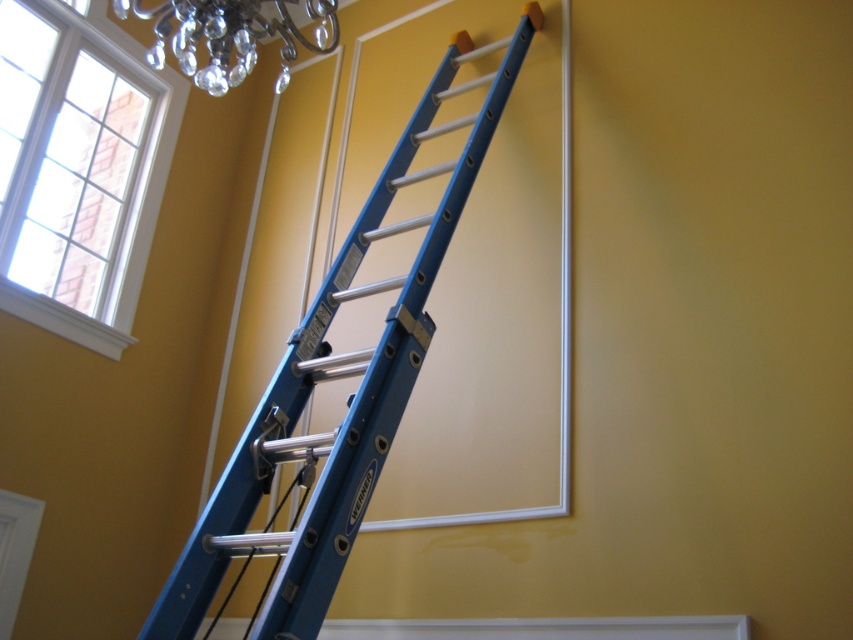
Question: Which object is positioned closest to the clear glass window at upper left?

Choices:
 (A) crystal glass chandelier at upper left
 (B) blue metallic ladder at upper right

Answer: (A)

Question: Which point appears closest to the camera in this image?

Choices:
 (A) (26, 131)
 (B) (412, 157)

Answer: (B)

Question: Does blue metallic ladder at upper right have a greater width compared to crystal glass chandelier at upper left?

Choices:
 (A) no
 (B) yes

Answer: (B)

Question: Can you confirm if clear glass window at upper left is thinner than crystal glass chandelier at upper left?

Choices:
 (A) yes
 (B) no

Answer: (B)

Question: Is the position of clear glass window at upper left less distant than that of crystal glass chandelier at upper left?

Choices:
 (A) no
 (B) yes

Answer: (A)

Question: Which object is positioned farthest from the blue metallic ladder at upper right?

Choices:
 (A) crystal glass chandelier at upper left
 (B) clear glass window at upper left

Answer: (B)